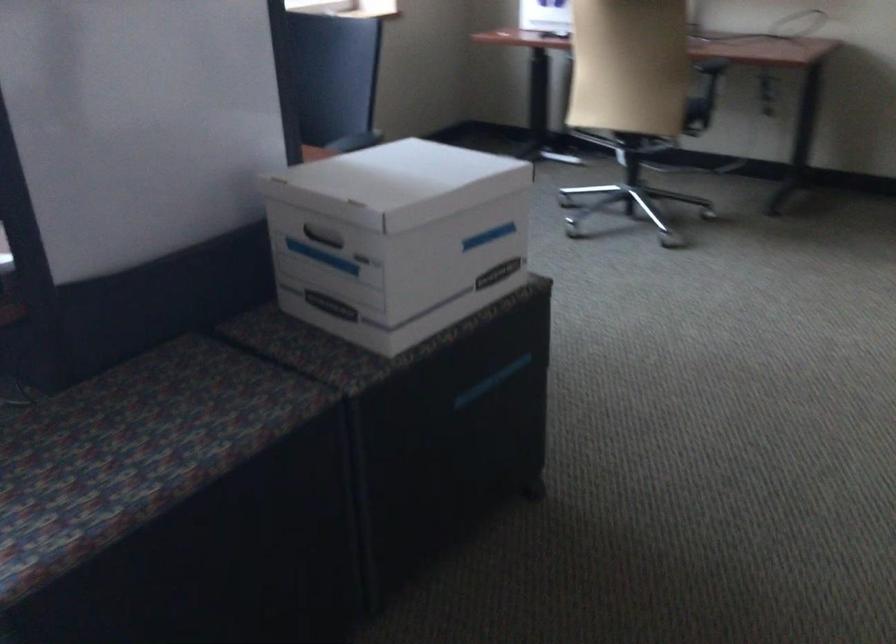
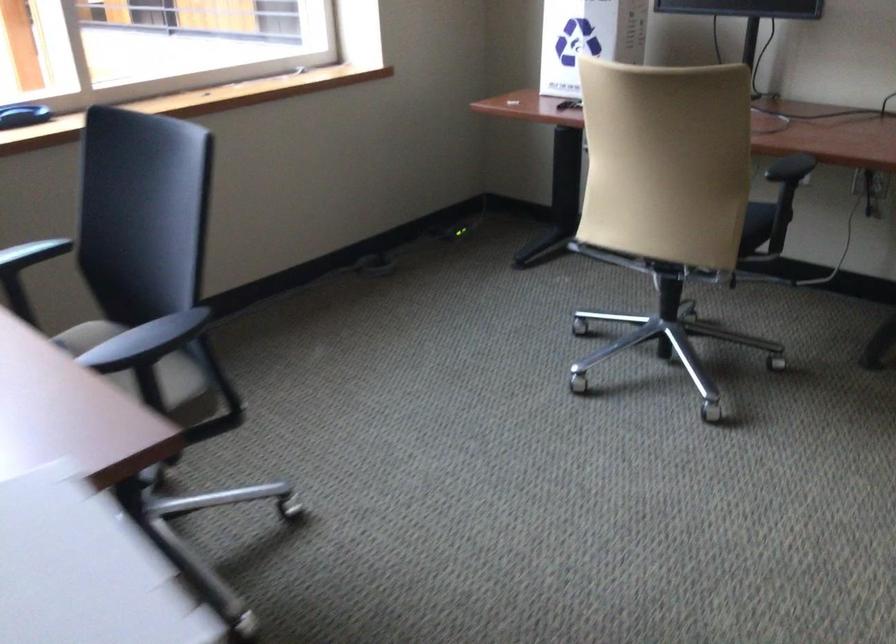
Find the pixel in the second image that matches (x=699, y=102) in the first image.

(755, 225)